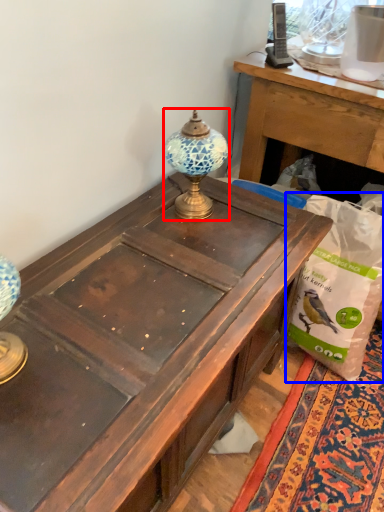
Question: Which point is further to the camera, lamp (highlighted by a red box) or paper bag (highlighted by a blue box)?

Choices:
 (A) lamp
 (B) paper bag

Answer: (B)